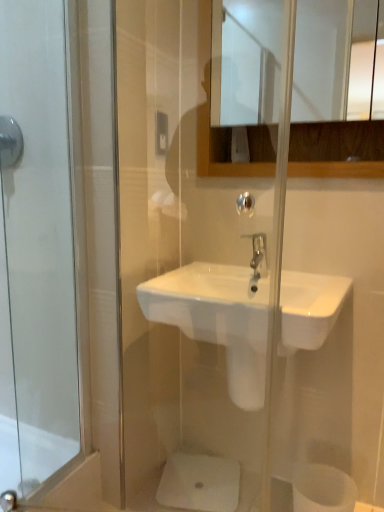
Question: Is white matte toilet paper at lower right looking in the opposite direction of glossy wooden mirror at upper center?

Choices:
 (A) yes
 (B) no

Answer: (B)

Question: Can we say white matte toilet paper at lower right lies outside glossy wooden mirror at upper center?

Choices:
 (A) yes
 (B) no

Answer: (A)

Question: Is white matte toilet paper at lower right wider than glossy wooden mirror at upper center?

Choices:
 (A) no
 (B) yes

Answer: (B)

Question: Is glossy wooden mirror at upper center a part of white matte toilet paper at lower right?

Choices:
 (A) yes
 (B) no

Answer: (B)

Question: From the image's perspective, is white matte toilet paper at lower right under glossy wooden mirror at upper center?

Choices:
 (A) yes
 (B) no

Answer: (A)

Question: Does white matte toilet paper at lower right have a greater height compared to glossy wooden mirror at upper center?

Choices:
 (A) no
 (B) yes

Answer: (A)

Question: Can we say brushed metal shower at upper left lies outside glossy wooden mirror at upper center?

Choices:
 (A) yes
 (B) no

Answer: (A)

Question: Does brushed metal shower at upper left lie in front of glossy wooden mirror at upper center?

Choices:
 (A) yes
 (B) no

Answer: (B)

Question: Is brushed metal shower at upper left further to the viewer compared to glossy wooden mirror at upper center?

Choices:
 (A) yes
 (B) no

Answer: (A)

Question: Does brushed metal shower at upper left have a lesser height compared to glossy wooden mirror at upper center?

Choices:
 (A) yes
 (B) no

Answer: (A)

Question: Is brushed metal shower at upper left facing towards glossy wooden mirror at upper center?

Choices:
 (A) yes
 (B) no

Answer: (B)

Question: Does brushed metal shower at upper left have a lesser width compared to glossy wooden mirror at upper center?

Choices:
 (A) no
 (B) yes

Answer: (A)

Question: Can we say brushed metal shower at upper left lies outside white matte toilet paper at lower right?

Choices:
 (A) no
 (B) yes

Answer: (B)